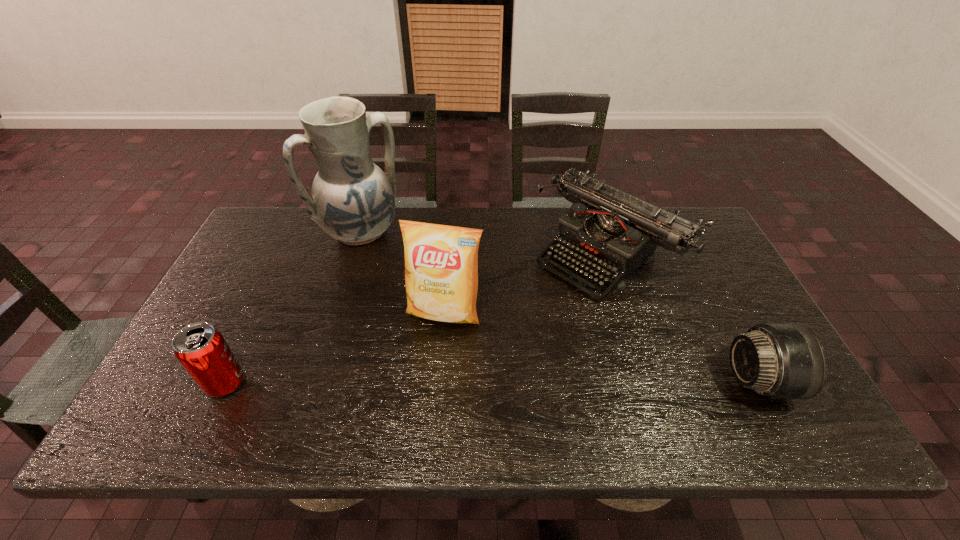
The image size is (960, 540). I want to click on empty space that is in between the crisp (potato chip) and the tallest object, so click(x=402, y=273).

Locate an element on the screen. Image resolution: width=960 pixels, height=540 pixels. free space between the leftmost object and the typewriter is located at coordinates (417, 318).

Choose which object is the third nearest neighbor to the second object from left to right. Please provide its 2D coordinates. Your answer should be formatted as a tuple, i.e. [(x, y)], where the tuple contains the x and y coordinates of a point satisfying the conditions above.

[(614, 232)]

Point out which object is positioned as the second nearest to the typewriter. Please provide its 2D coordinates. Your answer should be formatted as a tuple, i.e. [(x, y)], where the tuple contains the x and y coordinates of a point satisfying the conditions above.

[(776, 360)]

Identify the location of vacant space that satisfies the following two spatial constraints: 1. on the back side of the crisp (potato chip); 2. on the right side of the leftmost object. coord(258,314).

The width and height of the screenshot is (960, 540). Identify the location of free space that satisfies the following two spatial constraints: 1. on the front side of the tallest object; 2. on the front-facing side of the telephoto lens. (315, 382).

Where is `free region that satisfies the following two spatial constraints: 1. on the back side of the telephoto lens; 2. on the front-facing side of the soda can`? The height and width of the screenshot is (540, 960). free region that satisfies the following two spatial constraints: 1. on the back side of the telephoto lens; 2. on the front-facing side of the soda can is located at coordinates (227, 382).

You are a GUI agent. You are given a task and a screenshot of the screen. Output one action in this format:
    pyautogui.click(x=<x>, y=<y>)
    Task: Click on the free space that satisfies the following two spatial constraints: 1. on the front side of the second object from left to right; 2. on the front-facing side of the telephoto lens
    The width and height of the screenshot is (960, 540).
    Given the screenshot: What is the action you would take?
    pyautogui.click(x=315, y=382)